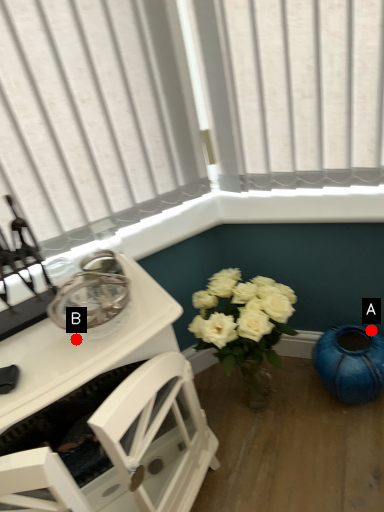
Question: Two points are circled on the image, labeled by A and B beside each circle. Which point appears closest to the camera in this image?

Choices:
 (A) A is closer
 (B) B is closer

Answer: (B)